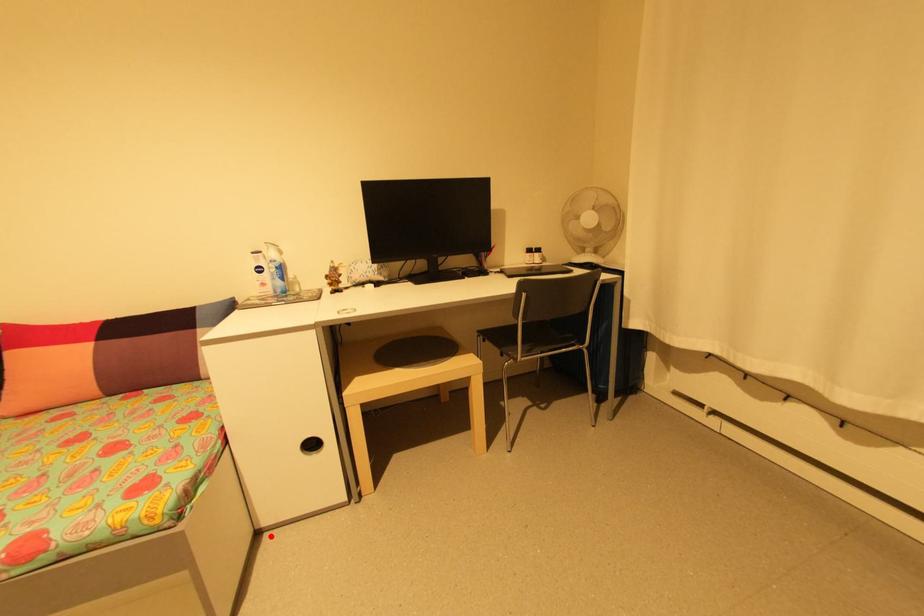
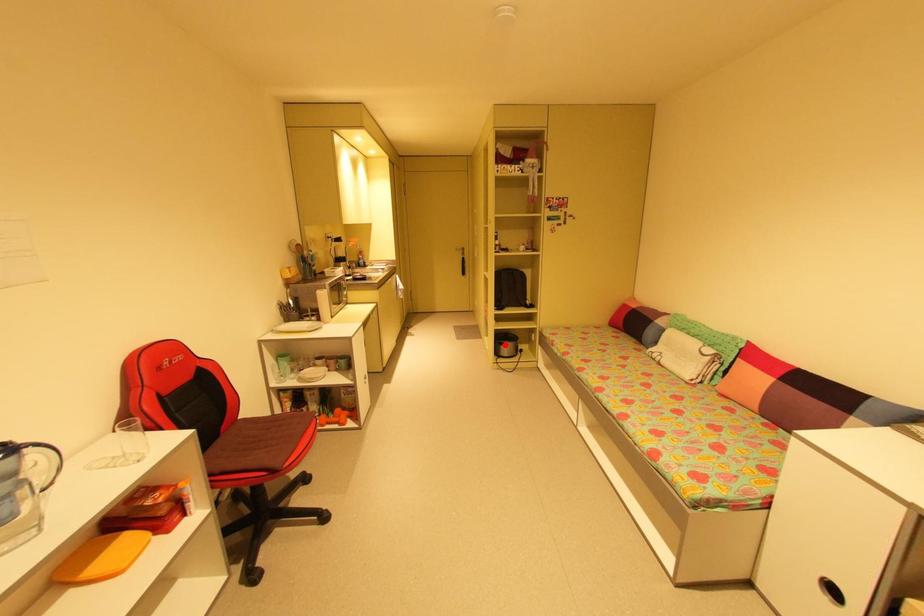
I am providing you with two images of the same scene from different viewpoints. A red point is marked on the first image and another point is marked on the second image. Is the marked point in image1 the same physical position as the marked point in image2?

No